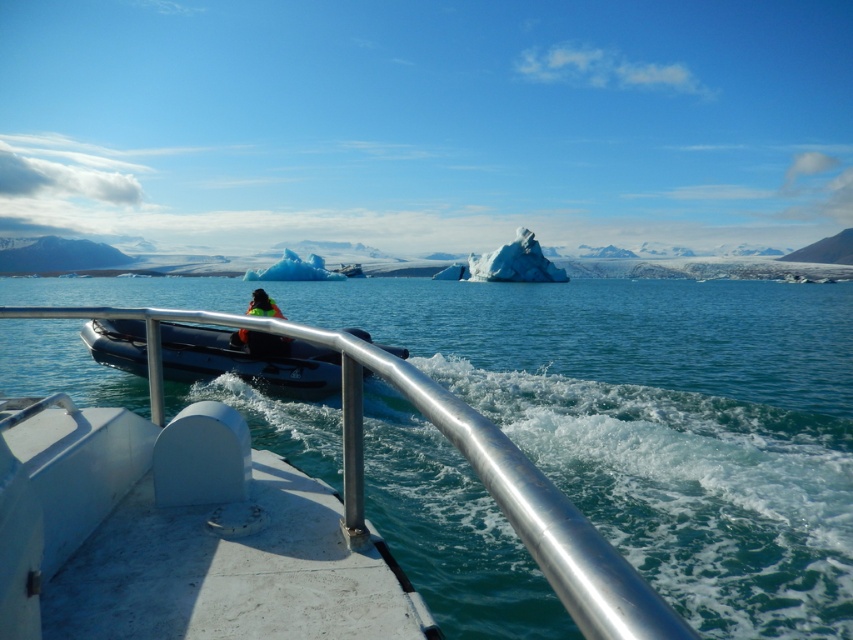
The width and height of the screenshot is (853, 640). What do you see at coordinates (527, 509) in the screenshot?
I see `silver metallic rail at center` at bounding box center [527, 509].

Describe the element at coordinates (527, 509) in the screenshot. I see `silver metallic rail at center` at that location.

Locate an element on the screen. The width and height of the screenshot is (853, 640). silver metallic rail at center is located at coordinates (527, 509).

From the picture: Does silver metallic rail at center appear on the right side of rubberized black boat at center?

Yes, silver metallic rail at center is to the right of rubberized black boat at center.

Is silver metallic rail at center positioned behind rubberized black boat at center?

No, it is in front of rubberized black boat at center.

Who is more distant from viewer, [350,449] or [192,360]?

Positioned behind is point [192,360].

You are a GUI agent. You are given a task and a screenshot of the screen. Output one action in this format:
    pyautogui.click(x=<x>, y=<y>)
    Task: Click on the silver metallic rail at center
    This screenshot has width=853, height=640.
    Given the screenshot: What is the action you would take?
    pyautogui.click(x=527, y=509)

Who is positioned more to the left, clear blue water at center or neon green life vest at center?

Positioned to the left is neon green life vest at center.

Locate an element on the screen. clear blue water at center is located at coordinates (659, 420).

Locate an element on the screen. clear blue water at center is located at coordinates (659, 420).